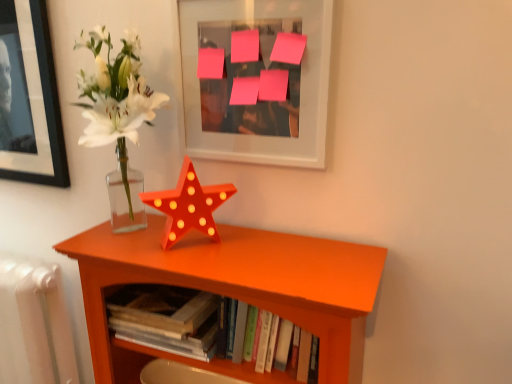
Question: Should I look upward or downward to see matte glass vase at center left?

Choices:
 (A) down
 (B) up

Answer: (A)

Question: Does pink paper at upper center have a larger size compared to matte glass vase at center left?

Choices:
 (A) yes
 (B) no

Answer: (A)

Question: Can you confirm if pink paper at upper center is shorter than matte glass vase at center left?

Choices:
 (A) no
 (B) yes

Answer: (A)

Question: Could you tell me if pink paper at upper center is turned towards matte glass vase at center left?

Choices:
 (A) yes
 (B) no

Answer: (B)

Question: Is pink paper at upper center oriented away from matte glass vase at center left?

Choices:
 (A) no
 (B) yes

Answer: (A)

Question: Is pink paper at upper center to the right of matte glass vase at center left from the viewer's perspective?

Choices:
 (A) yes
 (B) no

Answer: (A)

Question: From the image's perspective, would you say pink paper at upper center is shown under matte glass vase at center left?

Choices:
 (A) yes
 (B) no

Answer: (B)

Question: From a real-world perspective, is orange wood shelf at center on top of hardcover books at center?

Choices:
 (A) no
 (B) yes

Answer: (A)

Question: Is orange wood shelf at center to the right of hardcover books at center from the viewer's perspective?

Choices:
 (A) no
 (B) yes

Answer: (B)

Question: Is orange wood shelf at center oriented away from hardcover books at center?

Choices:
 (A) yes
 (B) no

Answer: (A)

Question: Is orange wood shelf at center positioned behind hardcover books at center?

Choices:
 (A) no
 (B) yes

Answer: (A)

Question: From the image's perspective, is orange wood shelf at center on hardcover books at center?

Choices:
 (A) yes
 (B) no

Answer: (B)

Question: Is orange wood shelf at center bigger than hardcover books at center?

Choices:
 (A) no
 (B) yes

Answer: (B)

Question: Considering the relative positions of pink paper at upper center and orange wood shelf at center in the image provided, is pink paper at upper center in front of orange wood shelf at center?

Choices:
 (A) yes
 (B) no

Answer: (B)